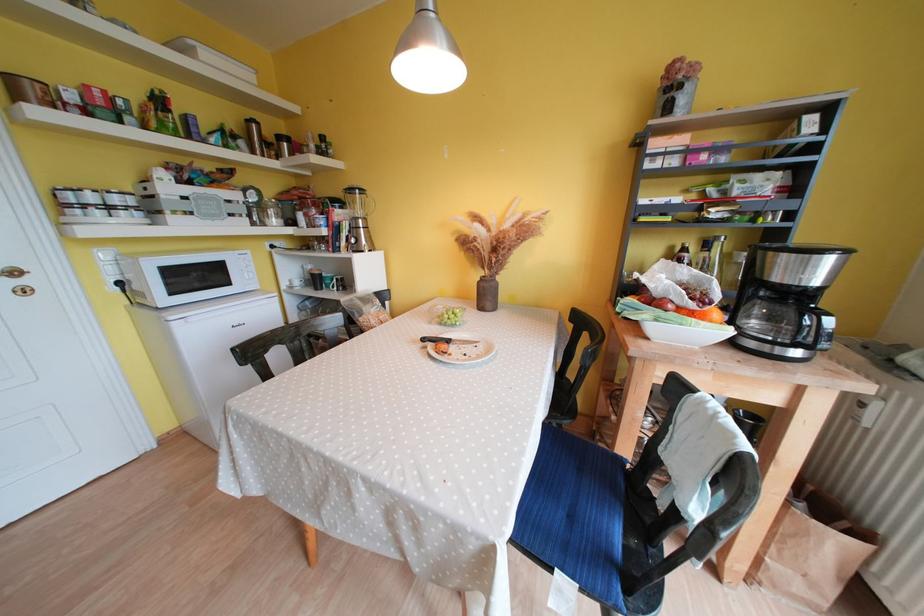
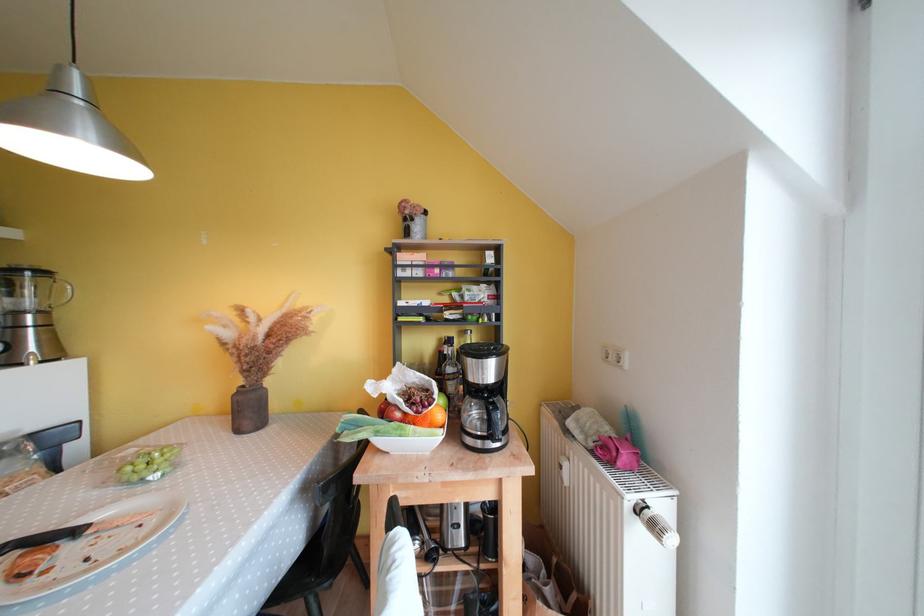
Find the pixel in the second image that matches (x=454, y=344) in the first image.

(83, 535)